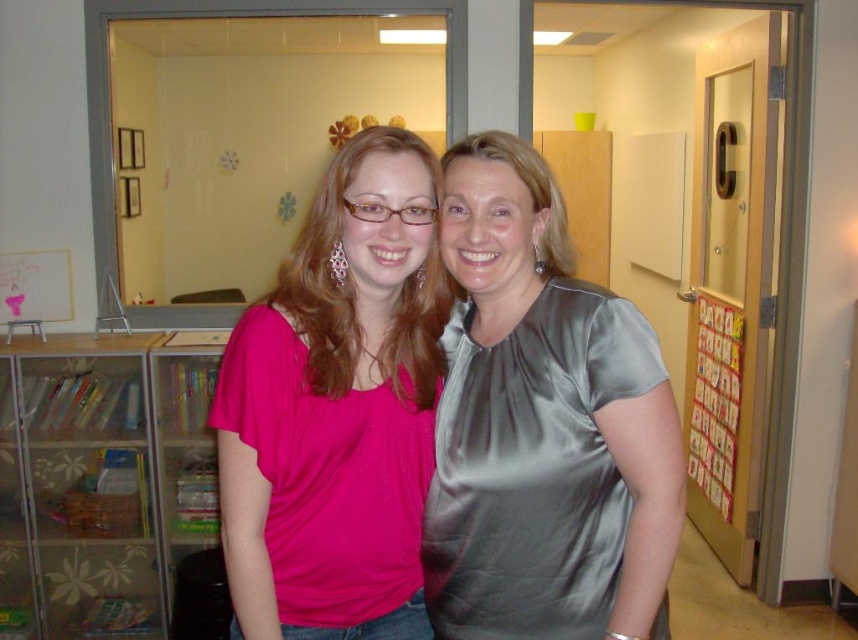
Is satin gray dress at center bigger than translucent plastic bookshelf at left?

Incorrect, satin gray dress at center is not larger than translucent plastic bookshelf at left.

Is point (493, 620) closer to camera compared to point (65, 588)?

That is True.

Identify the location of satin gray dress at center. The height and width of the screenshot is (640, 858). (533, 468).

Is point (237, 438) positioned before point (98, 636)?

That is True.

Measure the distance between pink satin blouse at center and camera.

They are 3.79 feet apart.

Is point (357, 272) behind point (168, 486)?

No, (357, 272) is closer to viewer.

This screenshot has width=858, height=640. I want to click on pink satin blouse at center, so click(x=337, y=406).

Which is in front, point (420, 472) or point (541, 618)?

Point (541, 618)

Who is higher up, pink satin blouse at center or satin gray dress at center?

pink satin blouse at center is above.

Where is `pink satin blouse at center`? This screenshot has width=858, height=640. pink satin blouse at center is located at coordinates (337, 406).